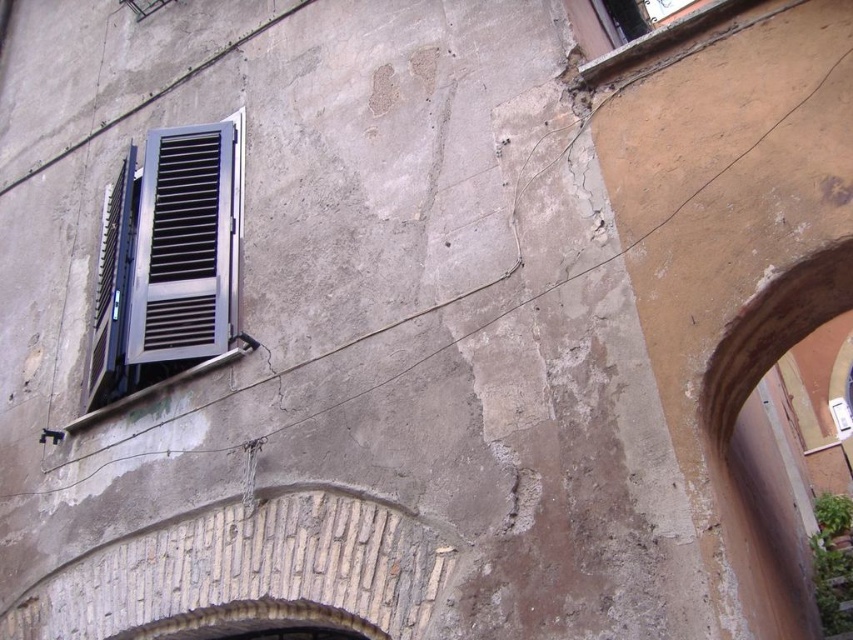
Which is more to the left, metallic silver shutter at left or smooth stone archway at center?

Positioned to the left is metallic silver shutter at left.

Is metallic silver shutter at left positioned before smooth stone archway at center?

No, it is behind smooth stone archway at center.

Is point (154, 316) farther from viewer compared to point (699, 392)?

Yes, it is.

The image size is (853, 640). Identify the location of metallic silver shutter at left. (183, 244).

Between metallic gray window at left and smooth stone archway at center, which one has less height?

Standing shorter between the two is smooth stone archway at center.

Does point (194, 257) come behind point (817, 304)?

Yes, point (194, 257) is behind point (817, 304).

The image size is (853, 640). In order to click on metallic gray window at left in this screenshot , I will do `click(167, 259)`.

Which is above, metallic gray window at left or metallic silver shutter at left?

Positioned higher is metallic gray window at left.

Locate an element on the screen. Image resolution: width=853 pixels, height=640 pixels. metallic gray window at left is located at coordinates (167, 259).